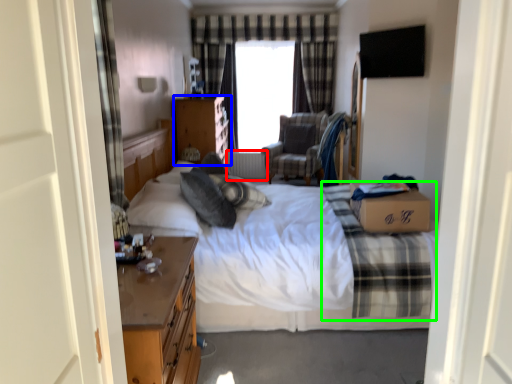
Question: Which object is the farthest from radiator (highlighted by a red box)? Choose among these: chest of drawers (highlighted by a blue box) or plaid (highlighted by a green box).

Choices:
 (A) chest of drawers
 (B) plaid

Answer: (B)